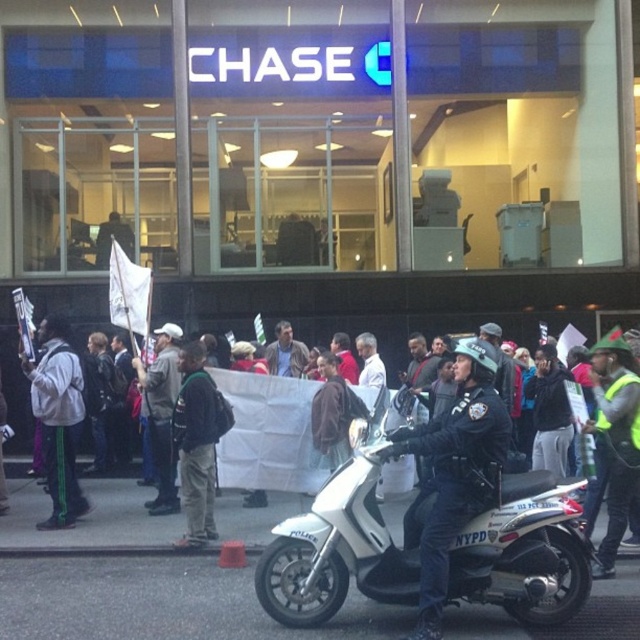
Does white fabric banner at center appear over gray fabric jacket at center?

No.

I want to click on white fabric banner at center, so click(x=268, y=433).

Identify the location of white fabric banner at center. The width and height of the screenshot is (640, 640). (268, 433).

Which is more to the left, dark gray backpack at center or gray fabric jacket at center?

gray fabric jacket at center is more to the left.

Is point (208, 536) closer to viewer compared to point (132, 364)?

That is True.

The height and width of the screenshot is (640, 640). Find the location of `dark gray backpack at center`. dark gray backpack at center is located at coordinates pos(195,444).

Does black leather helmet at center have a larger size compared to dark gray backpack at center?

Yes, black leather helmet at center is bigger than dark gray backpack at center.

Between black leather helmet at center and dark gray backpack at center, which one is positioned higher?

black leather helmet at center

Locate an element on the screen. The width and height of the screenshot is (640, 640). black leather helmet at center is located at coordinates (452, 472).